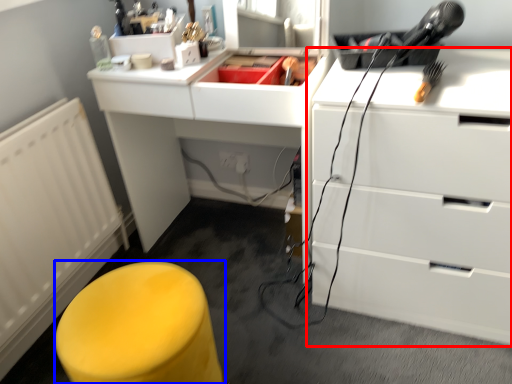
Question: Which point is closer to the camera, chest of drawers (highlighted by a red box) or furniture (highlighted by a blue box)?

Choices:
 (A) chest of drawers
 (B) furniture

Answer: (B)